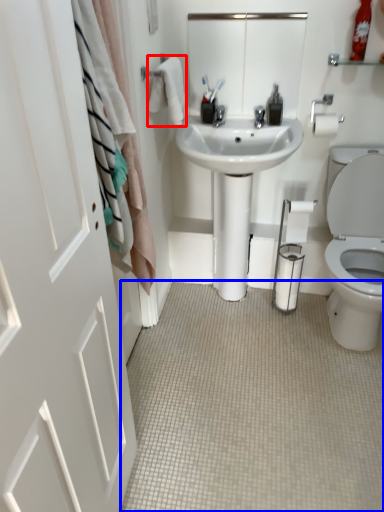
Question: Which object is closer to the camera taking this photo, bath towel (highlighted by a red box) or plain (highlighted by a blue box)?

Choices:
 (A) bath towel
 (B) plain

Answer: (B)